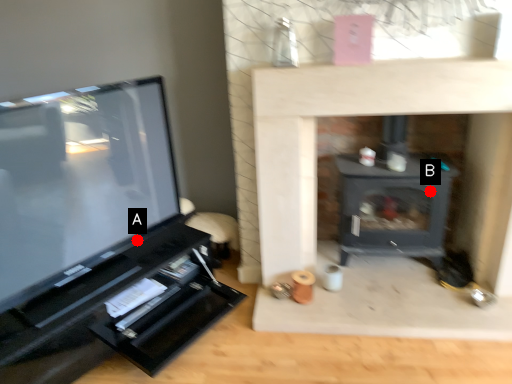
Question: Two points are circled on the image, labeled by A and B beside each circle. Which point appears closest to the camera in this image?

Choices:
 (A) A is closer
 (B) B is closer

Answer: (B)